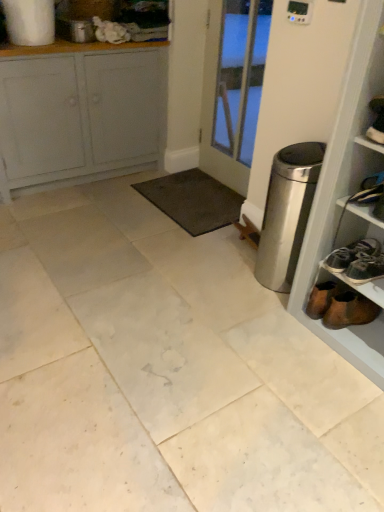
Question: Could white marble tile at center be considered to be inside white painted wood cabinet at upper left?

Choices:
 (A) yes
 (B) no

Answer: (B)

Question: From a real-world perspective, is white painted wood cabinet at upper left positioned over white marble tile at center based on gravity?

Choices:
 (A) no
 (B) yes

Answer: (B)

Question: From the image's perspective, is white painted wood cabinet at upper left located beneath white marble tile at center?

Choices:
 (A) no
 (B) yes

Answer: (A)

Question: Is white marble tile at center at the back of white painted wood cabinet at upper left?

Choices:
 (A) yes
 (B) no

Answer: (B)

Question: Does white painted wood cabinet at upper left come in front of white marble tile at center?

Choices:
 (A) yes
 (B) no

Answer: (B)

Question: Does point (72, 118) appear closer or farther from the camera than point (185, 173)?

Choices:
 (A) closer
 (B) farther

Answer: (A)

Question: From their relative heights in the image, would you say white painted wood cabinet at upper left is taller or shorter than dark gray carpet at center?

Choices:
 (A) tall
 (B) short

Answer: (A)

Question: Would you say white painted wood cabinet at upper left is inside or outside dark gray carpet at center?

Choices:
 (A) inside
 (B) outside

Answer: (B)

Question: From the image's perspective, is white painted wood cabinet at upper left positioned above or below dark gray carpet at center?

Choices:
 (A) above
 (B) below

Answer: (A)

Question: Considering the positions of white marble tile at center and dark gray carpet at center in the image, is white marble tile at center taller or shorter than dark gray carpet at center?

Choices:
 (A) tall
 (B) short

Answer: (A)

Question: From a real-world perspective, is white marble tile at center above or below dark gray carpet at center?

Choices:
 (A) above
 (B) below

Answer: (B)

Question: Considering the positions of point pos(324,408) and point pos(216,190), is point pos(324,408) closer or farther from the camera than point pos(216,190)?

Choices:
 (A) farther
 (B) closer

Answer: (B)

Question: From the image's perspective, is white marble tile at center above or below dark gray carpet at center?

Choices:
 (A) above
 (B) below

Answer: (B)

Question: Is brown suede boot at lower right in front of or behind stainless steel trash can at right in the image?

Choices:
 (A) behind
 (B) front

Answer: (A)

Question: Based on their sizes in the image, would you say brown suede boot at lower right is bigger or smaller than stainless steel trash can at right?

Choices:
 (A) big
 (B) small

Answer: (B)